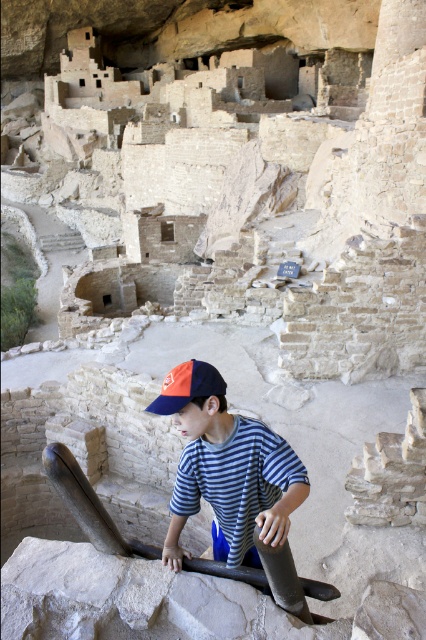
Which is more to the left, striped cotton shirt at center or orange/red fabric cap at lower center?

From the viewer's perspective, orange/red fabric cap at lower center appears more on the left side.

Which is behind, point (259, 435) or point (207, 388)?

Positioned behind is point (259, 435).

Is point (170, 378) positioned before point (195, 358)?

Yes, it is.

The image size is (426, 640). Find the location of `striped cotton shirt at center`. striped cotton shirt at center is located at coordinates (227, 468).